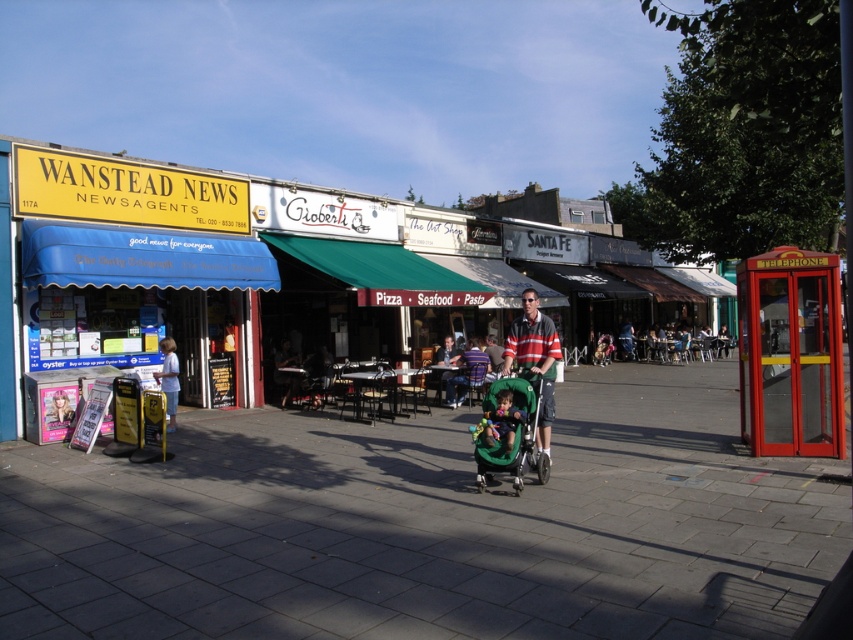
You are standing at the point marked by the coordinates (502, 420) in the image. What object are you directly standing on?

The point marked by the coordinates (502, 420) is directly on the green fabric baby carriage at center.

You are a delivery person who needs to park your bike on the smooth concrete pavement at lower left. The green fabric baby carriage at center is currently occupying part of the pavement. Can you fit your bike there if the bike requires 1.2 meters of space?

The smooth concrete pavement at lower left is bigger than the green fabric baby carriage at center, but the exact dimensions are not provided. However, since the pavement is larger, it might still accommodate the bike if there is enough remaining space after accounting for the carriage.

Based on the photo, you are a fashion designer observing a man in a street scene. He is wearing a striped cotton shirt at center and a smooth black jacket at center. Which piece of clothing is positioned higher on his body?

The striped cotton shirt at center is located above the smooth black jacket at center, so the striped cotton shirt at center is positioned higher on his body.